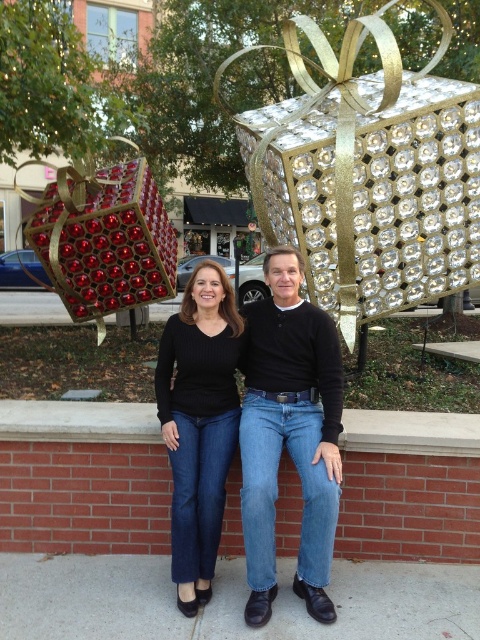
You are a photographer setting up for a group photo. You have a camera with a lens that can focus on objects within a 75 cm range. You need to ensure both the black matte jeans at center and the brick ledge at center are in focus. Can both objects be in focus with your current camera settings?

The black matte jeans at center and brick ledge at center are 81.31 centimeters apart from each other. Since the camera can focus within a 75 cm range, the distance between them exceeds the focus range, so both cannot be in focus simultaneously.

You are a photographer trying to capture a photo of the two people standing against the red brick wall. You notice the black matte jeans at center and the brick ledge at center in the background. Which object in the background occupies more visual space in the image?

The black matte jeans at center occupies more visual space in the image because it is larger in size than the brick ledge at center.